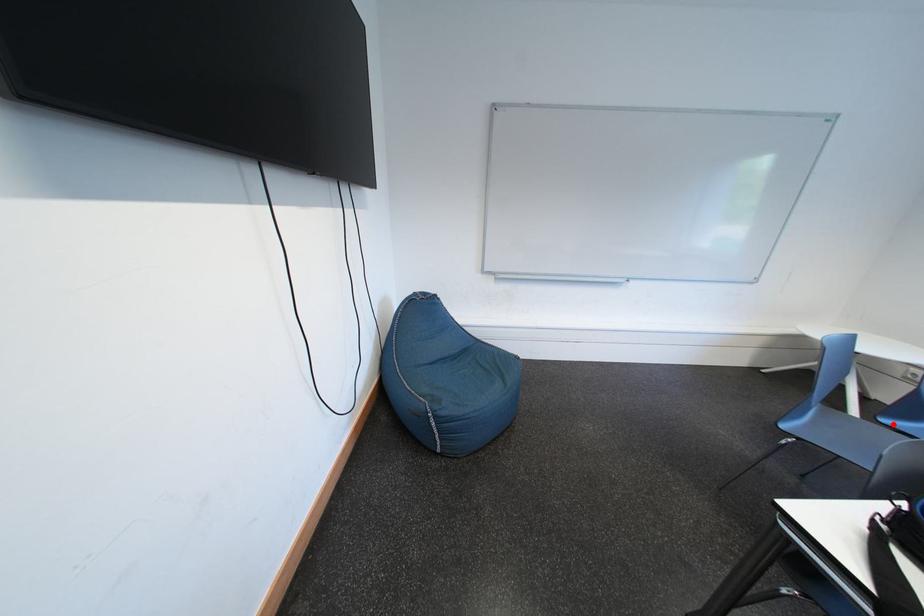
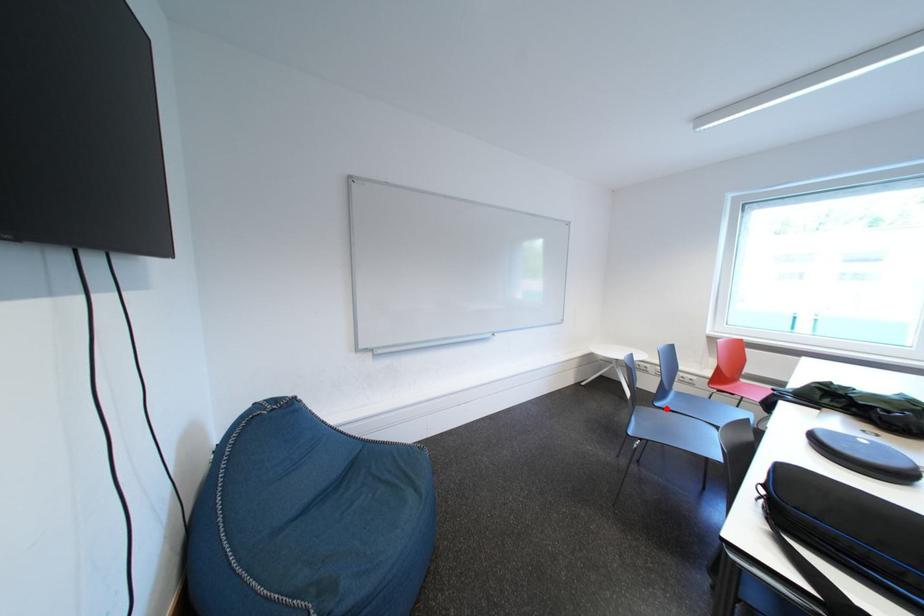
I am providing you with two images of the same scene from different viewpoints. A red point is marked on the first image and another point is marked on the second image. Does the point marked in image1 correspond to the same location as the one in image2?

Yes